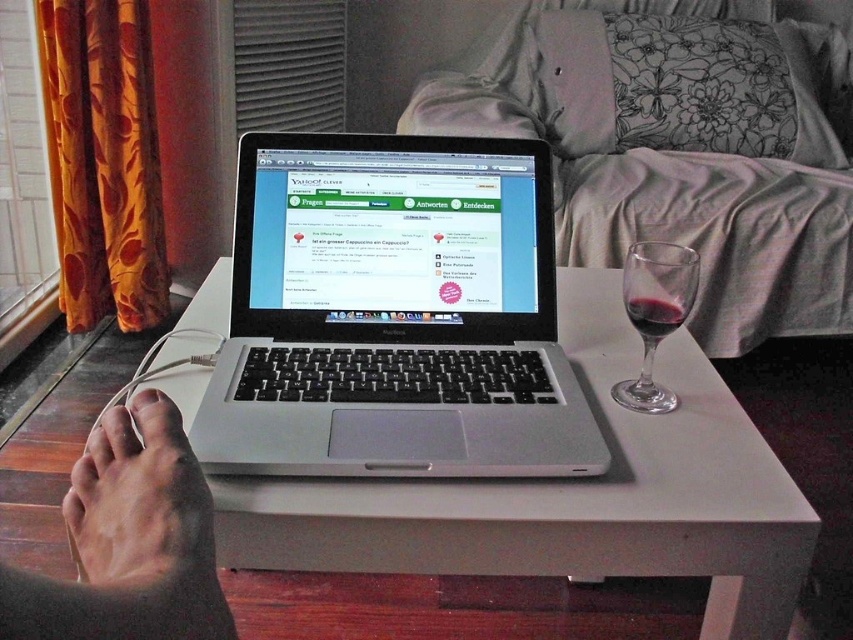
Is satin glass wine at right smaller than dry skin at lower left?

No.

Based on the photo, which is more to the left, satin glass wine at right or dry skin at lower left?

dry skin at lower left is more to the left.

Which is in front, point (577, 120) or point (146, 474)?

Point (146, 474) is in front.

This screenshot has width=853, height=640. In order to click on satin glass wine at right in this screenshot , I will do `click(677, 150)`.

Is satin glass wine at right in front of transparent glass at right?

No, it is behind transparent glass at right.

Which is in front, point (640, 144) or point (680, 312)?

Point (680, 312)

Does point (688, 150) come in front of point (689, 250)?

No, (688, 150) is further to viewer.

Where is `satin glass wine at right`? satin glass wine at right is located at coordinates (677, 150).

Is silver/black laptop at center below white matte table at center?

Actually, silver/black laptop at center is above white matte table at center.

Does silver/black laptop at center have a smaller size compared to white matte table at center?

Correct, silver/black laptop at center occupies less space than white matte table at center.

Is point (239, 433) less distant than point (778, 584)?

No, (239, 433) is behind (778, 584).

This screenshot has height=640, width=853. Find the location of `silver/black laptop at center`. silver/black laptop at center is located at coordinates (393, 314).